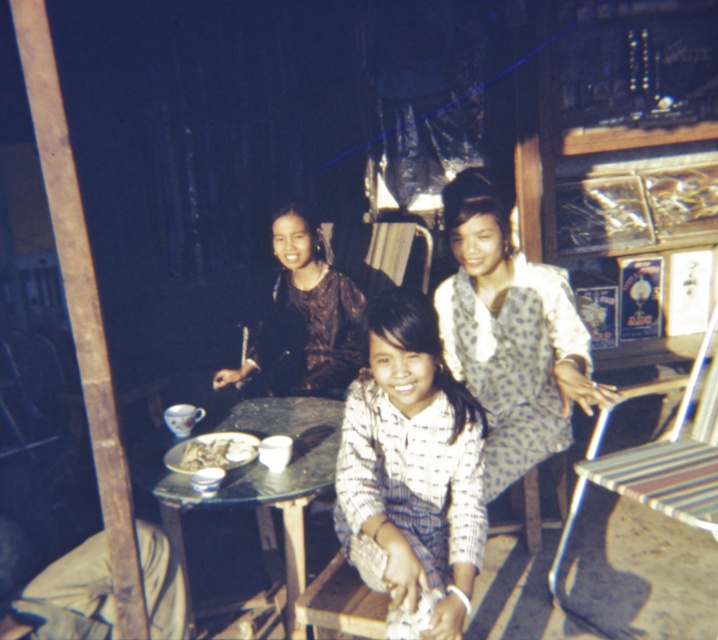
This screenshot has height=640, width=718. What do you see at coordinates (510, 333) in the screenshot? I see `polka dot blouse at center` at bounding box center [510, 333].

Is point (503, 481) in front of point (349, 328)?

Yes, it is.

This screenshot has height=640, width=718. I want to click on polka dot blouse at center, so click(x=510, y=333).

Can you confirm if polka dot blouse at center is positioned above white glossy plate at center?

Indeed, polka dot blouse at center is positioned over white glossy plate at center.

Who is higher up, polka dot blouse at center or white glossy plate at center?

Positioned higher is polka dot blouse at center.

What do you see at coordinates (510, 333) in the screenshot? The image size is (718, 640). I see `polka dot blouse at center` at bounding box center [510, 333].

Where is `polka dot blouse at center`? The width and height of the screenshot is (718, 640). polka dot blouse at center is located at coordinates (510, 333).

Describe the element at coordinates (265, 486) in the screenshot. I see `wooden table at center` at that location.

Which is more to the right, wooden table at center or metallic striped chair at right?

metallic striped chair at right is more to the right.

Is point (297, 448) more distant than point (691, 458)?

No, (297, 448) is closer to viewer.

I want to click on wooden table at center, so click(x=265, y=486).